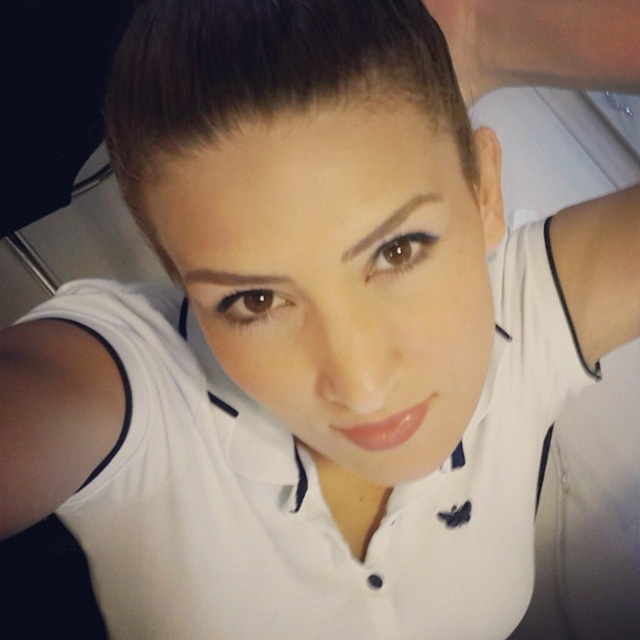
Based on the photo, you are a photographer trying to capture a closeup of the person in the selfie. The camera you are using has a focal length of 85mm and you want to maintain a safe distance of at least 2 feet from the subject to avoid distortion. Given the point at point (444, 474), which is 21.60 inches away from the subject, can you position yourself at a safe distance while still getting a clear closeup shot?

The point at point (444, 474) is 21.60 inches away from the subject. Since 21.60 inches is equal to 1.8 feet, which is less than the required 2 feet safe distance, you cannot position yourself at the safe distance while maintaining this point as the focus point. You need to move back further to ensure at least 2 feet separation.